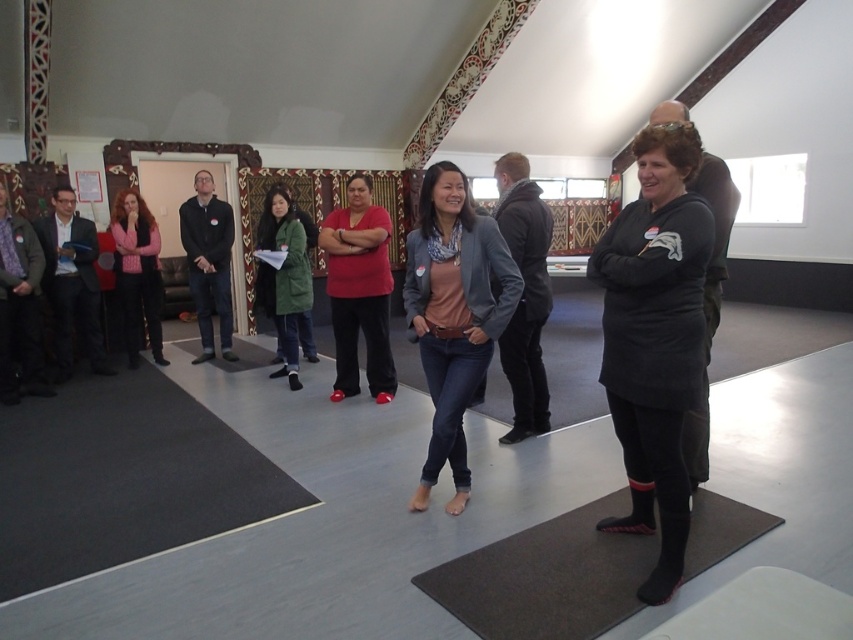
You are a photographer positioned at the entrance of the room. You need to take a photo that includes both the matte red shirt at center and the matte black suit at left. Based on their positions, which object should you adjust your camera angle to focus on first to ensure both are in frame?

The matte red shirt at center is to the right of the matte black suit at left. To capture both in the frame, you should first focus on the matte black suit at left, as it is positioned further left and the red shirt is to its right, allowing adjustment to include both by panning from left to right.